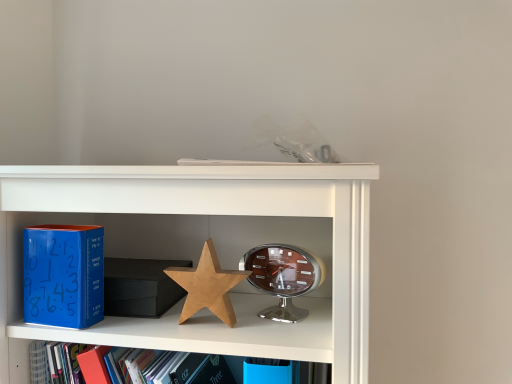
This screenshot has height=384, width=512. In order to click on wooden star at center in this screenshot , I will do `click(207, 286)`.

Find the location of `alarm clock below the wooden star at center (from a real-world perspective)`. alarm clock below the wooden star at center (from a real-world perspective) is located at coordinates (283, 277).

In terms of height, does shiny silver alarm clock at center look taller or shorter compared to wooden star at center?

Clearly, shiny silver alarm clock at center is shorter compared to wooden star at center.

Considering their positions, is shiny silver alarm clock at center located in front of or behind wooden star at center?

Visually, shiny silver alarm clock at center is located behind wooden star at center.

Is shiny silver alarm clock at center positioned far away from wooden star at center?

They are positioned close to each other.

How many degrees apart are the facing directions of blue matte clock at left and shiny silver alarm clock at center?

6.09 degrees.

From the image's perspective, does blue matte clock at left appear higher than shiny silver alarm clock at center?

Yes, from the image's perspective, blue matte clock at left is on top of shiny silver alarm clock at center.

Could you tell me if blue matte clock at left is turned towards shiny silver alarm clock at center?

No, blue matte clock at left does not turn towards shiny silver alarm clock at center.

Who is bigger, blue matte clock at left or wooden star at center?

blue matte clock at left is bigger.

Does blue matte clock at left have a lesser width compared to wooden star at center?

No, blue matte clock at left is not thinner than wooden star at center.

Where is `paperback book above the wooden star at center (from a real-world perspective)`? paperback book above the wooden star at center (from a real-world perspective) is located at coordinates [63, 275].

In the image, is blue matte clock at left on the left side or the right side of wooden star at center?

Clearly, blue matte clock at left is on the left of wooden star at center in the image.

Does wooden star at center contain shiny silver alarm clock at center?

No, wooden star at center does not contain shiny silver alarm clock at center.

Is wooden star at center placed right next to shiny silver alarm clock at center?

Yes, wooden star at center and shiny silver alarm clock at center clearly make contact.

Based on the photo, from a real-world perspective, who is located lower, wooden star at center or shiny silver alarm clock at center?

shiny silver alarm clock at center, from a real-world perspective.

Where is `alarm clock below the blue matte clock at left (from the image's perspective)`? The height and width of the screenshot is (384, 512). alarm clock below the blue matte clock at left (from the image's perspective) is located at coordinates (283, 277).

Is shiny silver alarm clock at center shorter than blue matte clock at left?

Yes, shiny silver alarm clock at center is shorter than blue matte clock at left.

Is shiny silver alarm clock at center positioned with its back to blue matte clock at left?

No, shiny silver alarm clock at center is not facing the opposite direction of blue matte clock at left.

From the image's perspective, is wooden star at center under blue matte clock at left?

Indeed, from the image's perspective, wooden star at center is shown beneath blue matte clock at left.

Considering the positions of points (234, 322) and (75, 263), is point (234, 322) closer to camera compared to point (75, 263)?

No, (234, 322) is further to viewer.

Between wooden star at center and blue matte clock at left, which one appears on the left side from the viewer's perspective?

blue matte clock at left is more to the left.

Is wooden star at center spatially inside blue matte clock at left, or outside of it?

wooden star at center lies outside blue matte clock at left.

I want to click on star that is in front of the shiny silver alarm clock at center, so click(x=207, y=286).

The image size is (512, 384). In order to click on alarm clock below the blue matte clock at left (from the image's perspective) in this screenshot , I will do `click(283, 277)`.

Considering their positions, is wooden star at center positioned further to blue matte clock at left than shiny silver alarm clock at center?

Based on the image, shiny silver alarm clock at center appears to be further to blue matte clock at left.

Based on the photo, which object lies nearer to the anchor point shiny silver alarm clock at center, blue matte clock at left or wooden star at center?

The object closer to shiny silver alarm clock at center is wooden star at center.

Which object lies nearer to the anchor point wooden star at center, blue matte clock at left or shiny silver alarm clock at center?

Based on the image, shiny silver alarm clock at center appears to be nearer to wooden star at center.

Considering their positions, is shiny silver alarm clock at center positioned closer to wooden star at center than blue matte clock at left?

shiny silver alarm clock at center lies closer to wooden star at center than the other object.

Based on their spatial positions, is shiny silver alarm clock at center or wooden star at center closer to blue matte clock at left?

Among the two, wooden star at center is located nearer to blue matte clock at left.

When comparing their distances from shiny silver alarm clock at center, does wooden star at center or blue matte clock at left seem closer?

wooden star at center is closer to shiny silver alarm clock at center.

The height and width of the screenshot is (384, 512). Identify the location of star located between blue matte clock at left and shiny silver alarm clock at center in the left-right direction. (207, 286).